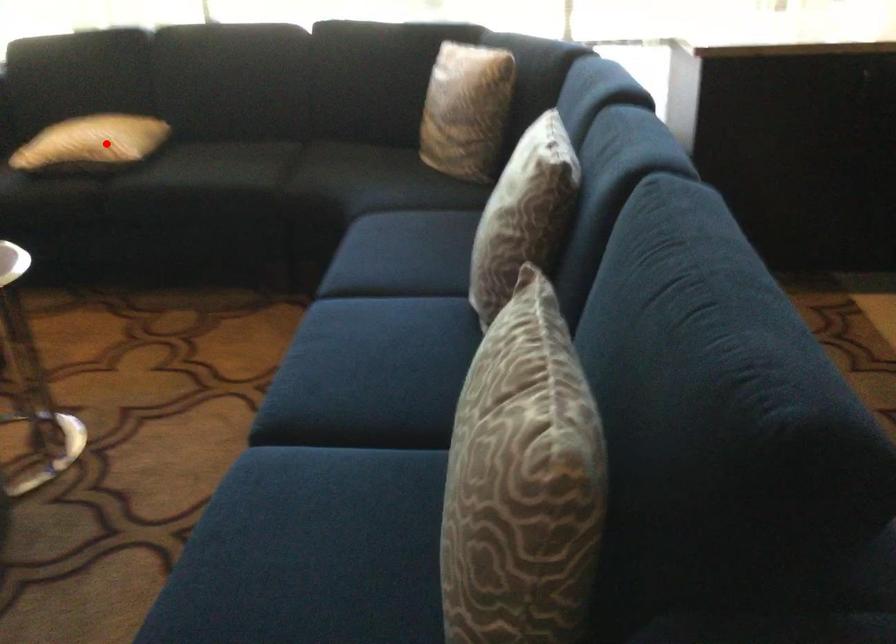
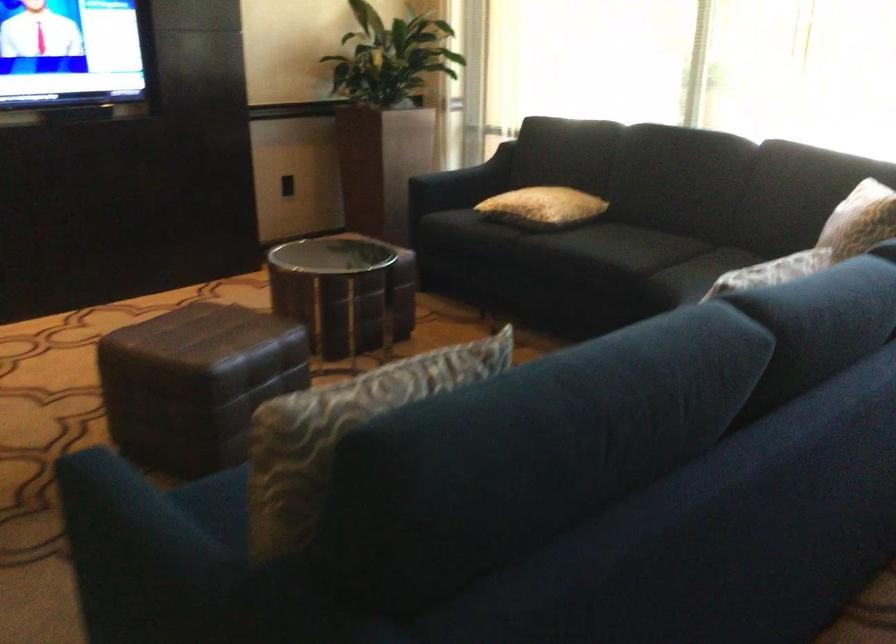
Find the pixel in the second image that matches the highlighted location in the first image.

(543, 207)